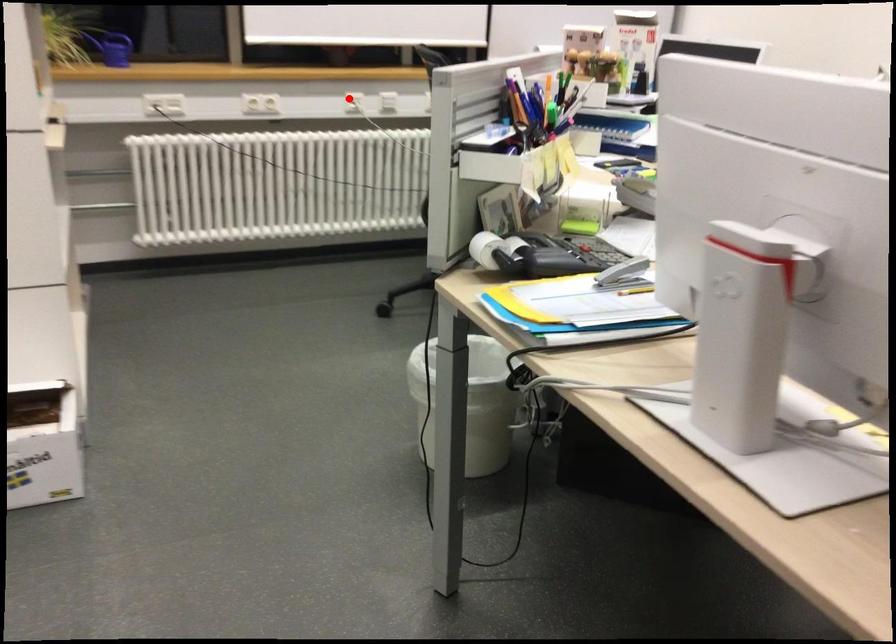
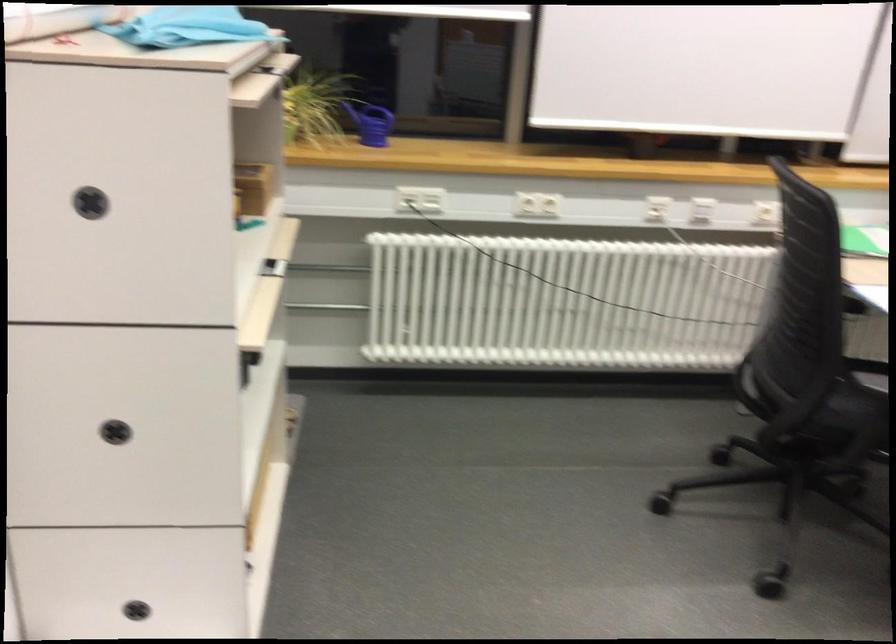
Locate, in the second image, the point that corresponds to the highlighted location in the first image.

(657, 209)